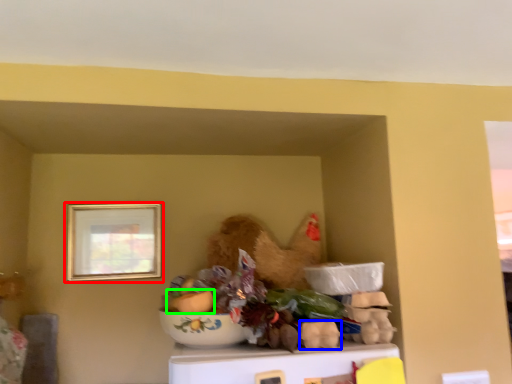
Question: Considering the real-world distances, which object is closest to picture frame (highlighted by a red box)? food (highlighted by a blue box) or food (highlighted by a green box).

Choices:
 (A) food
 (B) food

Answer: (B)